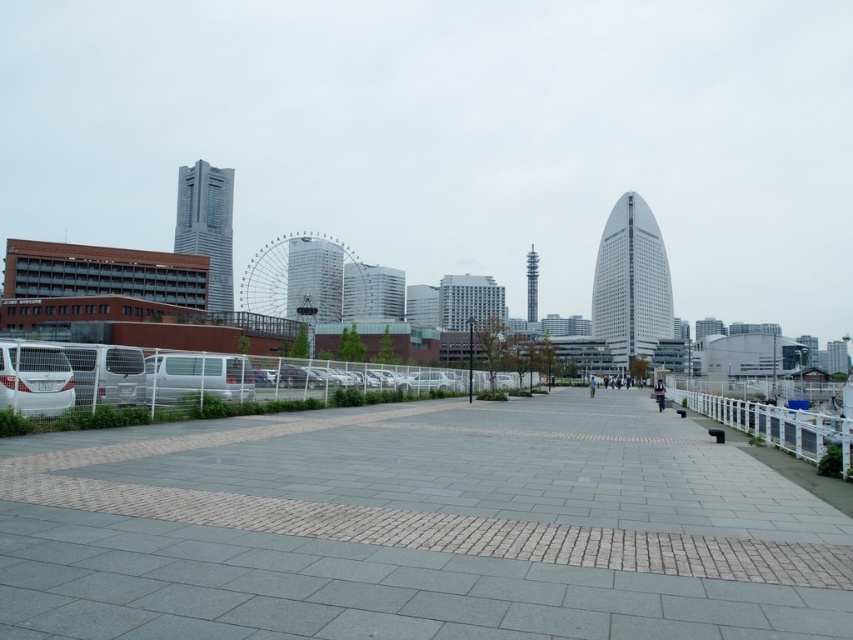
Which is above, gray concrete pavement at center or white plastic rail at lower right?

gray concrete pavement at center is above.

Can you confirm if gray concrete pavement at center is shorter than white plastic rail at lower right?

Indeed, gray concrete pavement at center has a lesser height compared to white plastic rail at lower right.

The width and height of the screenshot is (853, 640). I want to click on gray concrete pavement at center, so click(416, 529).